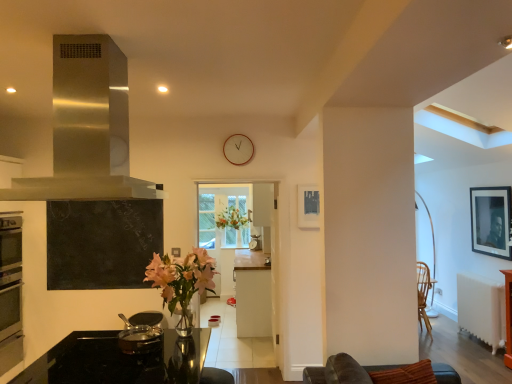
Question: Does matte black picture frame at center, which is the 1th picture frame in left-to-right order, lie in front of white matte cabinet at center?

Choices:
 (A) yes
 (B) no

Answer: (A)

Question: Does matte black picture frame at center, which is the second picture frame in back-to-front order, turn towards white matte cabinet at center?

Choices:
 (A) no
 (B) yes

Answer: (A)

Question: From a real-world perspective, is matte black picture frame at center, which is the second picture frame from right to left, on top of white matte cabinet at center?

Choices:
 (A) yes
 (B) no

Answer: (A)

Question: From the image's perspective, is matte black picture frame at center, which is the 1th picture frame in left-to-right order, beneath white matte cabinet at center?

Choices:
 (A) no
 (B) yes

Answer: (A)

Question: Can you confirm if matte black picture frame at center, which is the 1th picture frame in left-to-right order, is positioned to the left of white matte cabinet at center?

Choices:
 (A) yes
 (B) no

Answer: (B)

Question: Can you confirm if matte black picture frame at center, which ranks as the first picture frame in front-to-back order, is wider than white matte cabinet at center?

Choices:
 (A) no
 (B) yes

Answer: (A)

Question: Is matte black picture frame at center, which is the 1th picture frame in left-to-right order, taller than black matte picture frame at upper right, which is the second picture frame from front to back?

Choices:
 (A) no
 (B) yes

Answer: (A)

Question: From a real-world perspective, is matte black picture frame at center, which ranks as the first picture frame in front-to-back order, on top of black matte picture frame at upper right, which appears as the 1th picture frame when viewed from the right?

Choices:
 (A) no
 (B) yes

Answer: (B)

Question: Is matte black picture frame at center, which is the 1th picture frame in left-to-right order, turned away from black matte picture frame at upper right, the 1th picture frame in the back-to-front sequence?

Choices:
 (A) yes
 (B) no

Answer: (B)

Question: Can black matte picture frame at upper right, the 1th picture frame in the back-to-front sequence, be found inside matte black picture frame at center, which is the 1th picture frame in left-to-right order?

Choices:
 (A) yes
 (B) no

Answer: (B)

Question: Is matte black picture frame at center, which is the 1th picture frame in left-to-right order, closer to camera compared to black matte picture frame at upper right, positioned as the 2th picture frame in left-to-right order?

Choices:
 (A) yes
 (B) no

Answer: (A)

Question: Is matte black picture frame at center, which is the second picture frame in back-to-front order, oriented towards black matte picture frame at upper right, which appears as the 1th picture frame when viewed from the right?

Choices:
 (A) yes
 (B) no

Answer: (B)

Question: Would you say stainless steel exhaust hood at upper left contains shiny metallic pot at lower left?

Choices:
 (A) no
 (B) yes

Answer: (A)